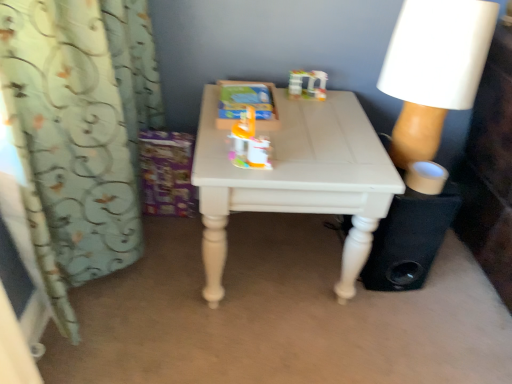
Question: From the image's perspective, is black fabric speaker at lower right located above orange plastic toy at center, positioned as the 2th toy in top-to-bottom order?

Choices:
 (A) no
 (B) yes

Answer: (A)

Question: Can you confirm if black fabric speaker at lower right is positioned to the right of orange plastic toy at center, which is the 1th toy in front-to-back order?

Choices:
 (A) yes
 (B) no

Answer: (A)

Question: Is black fabric speaker at lower right facing towards orange plastic toy at center, the 1th toy when ordered from left to right?

Choices:
 (A) yes
 (B) no

Answer: (B)

Question: From a real-world perspective, is black fabric speaker at lower right positioned under orange plastic toy at center, positioned as the 2th toy in right-to-left order, based on gravity?

Choices:
 (A) yes
 (B) no

Answer: (A)

Question: Would you say black fabric speaker at lower right is outside orange plastic toy at center, which is the 1th toy in front-to-back order?

Choices:
 (A) no
 (B) yes

Answer: (B)

Question: Is light blue fabric curtain at left spatially inside orange plastic toy at center, positioned as the 2th toy in top-to-bottom order, or outside of it?

Choices:
 (A) outside
 (B) inside

Answer: (A)

Question: Based on their positions, is light blue fabric curtain at left located to the left or right of orange plastic toy at center, positioned as the 2th toy in right-to-left order?

Choices:
 (A) left
 (B) right

Answer: (A)

Question: Is light blue fabric curtain at left bigger or smaller than orange plastic toy at center, positioned as the 2th toy in top-to-bottom order?

Choices:
 (A) big
 (B) small

Answer: (A)

Question: Relative to orange plastic toy at center, which is the first toy in bottom-to-top order, is light blue fabric curtain at left in front or behind?

Choices:
 (A) behind
 (B) front

Answer: (B)

Question: From the image's perspective, is white painted wood table at center above or below light blue fabric curtain at left?

Choices:
 (A) above
 (B) below

Answer: (B)

Question: Considering their positions, is white painted wood table at center located in front of or behind light blue fabric curtain at left?

Choices:
 (A) behind
 (B) front

Answer: (A)

Question: From a real-world perspective, is white painted wood table at center physically located above or below light blue fabric curtain at left?

Choices:
 (A) above
 (B) below

Answer: (B)

Question: Does point (245, 170) appear closer or farther from the camera than point (35, 129)?

Choices:
 (A) closer
 (B) farther

Answer: (B)

Question: From the image's perspective, is black fabric speaker at lower right located above or below white painted wood table at center?

Choices:
 (A) below
 (B) above

Answer: (A)

Question: Would you say black fabric speaker at lower right is to the left or to the right of white painted wood table at center in the picture?

Choices:
 (A) right
 (B) left

Answer: (A)